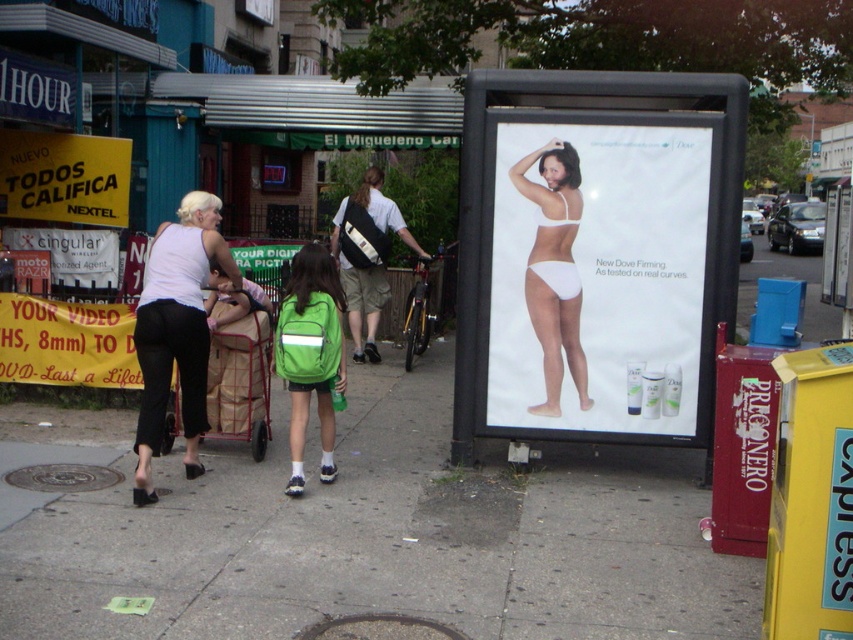
You are a delivery person who needs to place a large package on the ground. The scene shows concrete at center and white fabric bikini at center. Which surface would be more suitable for placing the package?

The concrete at center is bigger than the white fabric bikini at center, so the concrete at center would be more suitable for placing the large package as it provides a larger and sturdier surface.

You are standing in the middle of the street looking at the scene. Which of the two points, point (560, 170) or point (369, 346), is closer to you?

Point (560, 170) is closer to the viewer than point (369, 346).